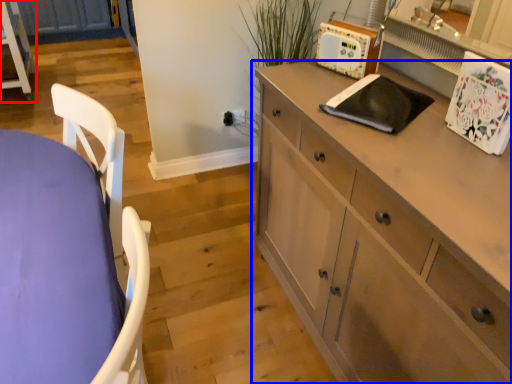
Question: Which object appears closest to the camera in this image, chest of drawers (highlighted by a red box) or cabinetry (highlighted by a blue box)?

Choices:
 (A) chest of drawers
 (B) cabinetry

Answer: (B)